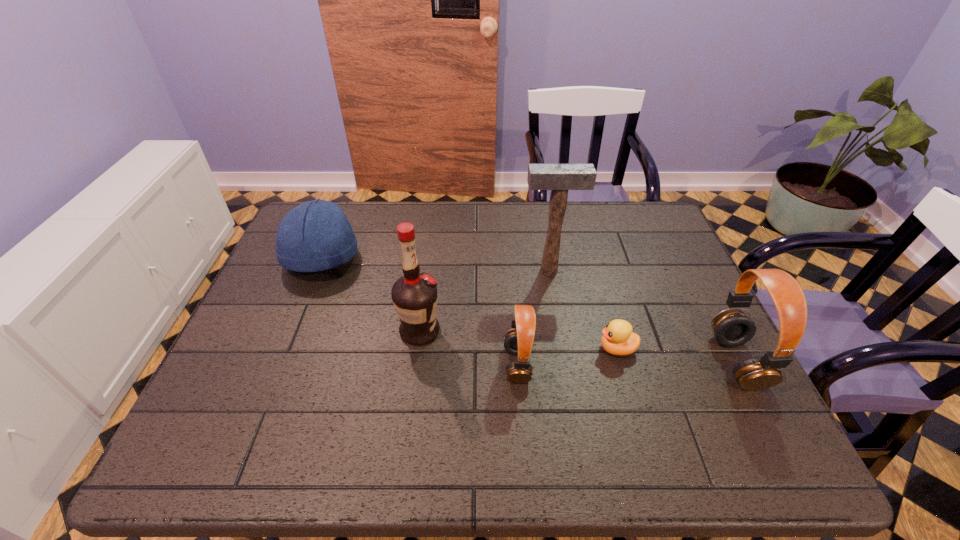
Locate an element on the screen. The image size is (960, 540). the left headset is located at coordinates (519, 341).

I want to click on the shorter headset, so click(519, 341).

What are the coordinates of `the rightmost object` in the screenshot? It's located at (732, 327).

Locate an element on the screen. The height and width of the screenshot is (540, 960). the taller headset is located at coordinates (732, 327).

Find the location of `the fourth object from left to right`. the fourth object from left to right is located at coordinates click(x=559, y=178).

Image resolution: width=960 pixels, height=540 pixels. In order to click on the leftmost object in this screenshot , I will do `click(316, 235)`.

Locate an element on the screen. liquor is located at coordinates (414, 295).

Where is `the fifth object from left to right`? Image resolution: width=960 pixels, height=540 pixels. the fifth object from left to right is located at coordinates pos(618,339).

Locate an element on the screen. This screenshot has height=540, width=960. the shortest object is located at coordinates (618, 339).

The width and height of the screenshot is (960, 540). I want to click on free spot located 0.360m on the ear cups of the left headset, so click(348, 364).